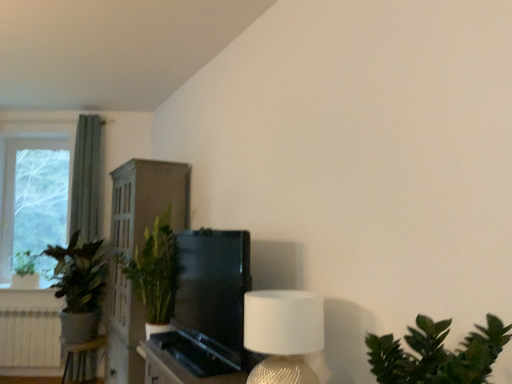
Where is `clear glass window at left`? clear glass window at left is located at coordinates (39, 200).

In order to face white wood cabinet at center, should I rotate leftwards or rightwards?

You should look left and rotate roughly 14.806 degrees.

Locate an element on the screen. green matte plant at left, the 3th houseplant positioned from the front is located at coordinates (25, 271).

What is the approximate height of green leafy plant at lower right, the first houseplant when ordered from front to back?

green leafy plant at lower right, the first houseplant when ordered from front to back, is 9.94 inches in height.

Where is `green leafy plant at lower right, the first houseplant when ordered from front to back`? The image size is (512, 384). green leafy plant at lower right, the first houseplant when ordered from front to back is located at coordinates (437, 354).

This screenshot has width=512, height=384. I want to click on clear glass window at left, so click(x=39, y=200).

From a real-world perspective, between green leafy plant at left, the second houseplant positioned from the front, and green matte plant at left, the third houseplant viewed from the right, who is vertically lower?

In real-world perspective, green leafy plant at left, the second houseplant positioned from the front, is lower.

Which of these two, green leafy plant at left, arranged as the 2th houseplant when viewed from the right, or green matte plant at left, positioned as the first houseplant in back-to-front order, is bigger?

Bigger between the two is green leafy plant at left, arranged as the 2th houseplant when viewed from the right.

Relative to green matte plant at left, the third houseplant viewed from the right, is green leafy plant at left, arranged as the 2th houseplant when viewed from the right, in front or behind?

green leafy plant at left, arranged as the 2th houseplant when viewed from the right, is positioned closer to the viewer than green matte plant at left, the third houseplant viewed from the right.

Is green leafy plant at left, arranged as the 2th houseplant when viewed from the left, spatially inside green matte plant at left, the 3th houseplant positioned from the front, or outside of it?

green leafy plant at left, arranged as the 2th houseplant when viewed from the left, is spatially situated outside green matte plant at left, the 3th houseplant positioned from the front.

Can you confirm if white textured lampshade at upper right is bigger than white wood cabinet at center?

Incorrect, white textured lampshade at upper right is not larger than white wood cabinet at center.

From the image's perspective, between white textured lampshade at upper right and white wood cabinet at center, which one is located above?

white textured lampshade at upper right.

The height and width of the screenshot is (384, 512). Identify the location of dresser below the white textured lampshade at upper right (from the image's perspective). (147, 200).

Does white textured lampshade at upper right touch white wood cabinet at center?

No, white textured lampshade at upper right is not beside white wood cabinet at center.

Could you tell me if green leafy plant at left, which ranks as the 2th houseplant in back-to-front order, is facing white wood cabinet at center?

No, green leafy plant at left, which ranks as the 2th houseplant in back-to-front order, is not facing towards white wood cabinet at center.

Considering the sizes of objects green leafy plant at left, which ranks as the 2th houseplant in back-to-front order, and white wood cabinet at center in the image provided, who is bigger, green leafy plant at left, which ranks as the 2th houseplant in back-to-front order, or white wood cabinet at center?

With larger size is white wood cabinet at center.

Which object is wider, green leafy plant at left, arranged as the 2th houseplant when viewed from the left, or white wood cabinet at center?

With larger width is green leafy plant at left, arranged as the 2th houseplant when viewed from the left.

Locate an element on the screen. the 2nd houseplant below when counting from the white wood cabinet at center (from the image's perspective) is located at coordinates click(x=79, y=287).

Who is smaller, white textured radiator at lower left or green leafy plant at left, arranged as the 2th houseplant when viewed from the right?

With smaller size is white textured radiator at lower left.

From the image's perspective, starting from the white textured radiator at lower left, which houseplant is the 1st one above? Please provide its 2D coordinates.

[(79, 287)]

Does point (25, 359) appear closer or farther from the camera than point (54, 247)?

Point (25, 359) is farther from the camera than point (54, 247).

In the scene shown: Considering the relative positions of white textured radiator at lower left and green leafy plant at left, the second houseplant positioned from the front, in the image provided, is white textured radiator at lower left to the left or to the right of green leafy plant at left, the second houseplant positioned from the front,?

white textured radiator at lower left is positioned on green leafy plant at left, the second houseplant positioned from the front,'s left side.

Could you tell me if white wood cabinet at center is facing clear glass window at left?

No, white wood cabinet at center is not turned towards clear glass window at left.

From the image's perspective, which object appears higher, white wood cabinet at center or clear glass window at left?

clear glass window at left, from the image's perspective.

From a real-world perspective, between white wood cabinet at center and clear glass window at left, who is vertically higher?

clear glass window at left.

In the scene shown: Could clear glass window at left be considered to be inside white wood cabinet at center?

No, clear glass window at left is not a part of white wood cabinet at center.

Is green matte plant at left, the third houseplant viewed from the right, far from green leafy plant at lower right, which is the first houseplant from right to left?

Yes, green matte plant at left, the third houseplant viewed from the right, and green leafy plant at lower right, which is the first houseplant from right to left, are quite far apart.

Between green matte plant at left, the 3th houseplant positioned from the front, and green leafy plant at lower right, which is counted as the 3th houseplant, starting from the back, which one appears on the left side from the viewer's perspective?

From the viewer's perspective, green matte plant at left, the 3th houseplant positioned from the front, appears more on the left side.

How distant is green matte plant at left, the 1th houseplant from the left, from green leafy plant at lower right, which is the first houseplant from right to left?

green matte plant at left, the 1th houseplant from the left, is 5.14 meters from green leafy plant at lower right, which is the first houseplant from right to left.

How much distance is there between clear glass window at left and white wood cabinet at center?

clear glass window at left is 2.03 meters from white wood cabinet at center.

Does clear glass window at left appear on the right side of white wood cabinet at center?

No, clear glass window at left is not to the right of white wood cabinet at center.

Is clear glass window at left oriented away from white wood cabinet at center?

No, clear glass window at left is not facing away from white wood cabinet at center.

Is clear glass window at left thinner than white wood cabinet at center?

Indeed, clear glass window at left has a lesser width compared to white wood cabinet at center.

Identify the location of houseplant that is the 1st one when counting upward from the green leafy plant at left, arranged as the 2th houseplant when viewed from the right (from the image's perspective). This screenshot has height=384, width=512. (25, 271).

You are a GUI agent. You are given a task and a screenshot of the screen. Output one action in this format:
    pyautogui.click(x=<x>, y=<y>)
    Task: Click on the dresser below the white textured lampshade at upper right (from the image's perspective)
    
    Given the screenshot: What is the action you would take?
    pyautogui.click(x=147, y=200)

From the image, which object appears to be nearer to clear glass window at left, white textured lampshade at upper right or white wood cabinet at center?

white wood cabinet at center.

Looking at the image, which one is located closer to green matte plant at left, the third houseplant viewed from the right, white wood cabinet at center or white textured lampshade at upper right?

Based on the image, white wood cabinet at center appears to be nearer to green matte plant at left, the third houseplant viewed from the right.

Estimate the real-world distances between objects in this image. Which object is closer to white wood cabinet at center, white textured radiator at lower left or green leafy plant at left, the second houseplant positioned from the front?

green leafy plant at left, the second houseplant positioned from the front, is closer to white wood cabinet at center.

Which object lies further to the anchor point green leafy plant at lower right, which ranks as the 3th houseplant in left-to-right order, green matte plant at left, the 1th houseplant from the left, or white textured lampshade at upper right?

Based on the image, green matte plant at left, the 1th houseplant from the left, appears to be further to green leafy plant at lower right, which ranks as the 3th houseplant in left-to-right order.

From the image, which object appears to be farther from green leafy plant at lower right, which is counted as the 3th houseplant, starting from the back, white textured radiator at lower left or clear glass window at left?

Among the two, white textured radiator at lower left is located further to green leafy plant at lower right, which is counted as the 3th houseplant, starting from the back.

In the scene shown: Based on their spatial positions, is green leafy plant at lower right, which is the first houseplant from right to left, or clear glass window at left closer to green matte plant at left, the third houseplant viewed from the right?

Based on the image, clear glass window at left appears to be nearer to green matte plant at left, the third houseplant viewed from the right.

Based on their spatial positions, is white textured radiator at lower left or white textured lampshade at upper right further from green leafy plant at lower right, which ranks as the 3th houseplant in left-to-right order?

Based on the image, white textured radiator at lower left appears to be further to green leafy plant at lower right, which ranks as the 3th houseplant in left-to-right order.

Considering their positions, is white textured radiator at lower left positioned closer to green matte plant at left, the 3th houseplant positioned from the front, than green leafy plant at left, the second houseplant positioned from the front?

white textured radiator at lower left lies closer to green matte plant at left, the 3th houseplant positioned from the front, than the other object.

The image size is (512, 384). What are the coordinates of `dresser between green leafy plant at lower right, which ranks as the 3th houseplant in left-to-right order, and white textured radiator at lower left, along the z-axis` in the screenshot? It's located at (147, 200).

Locate an element on the screen. This screenshot has width=512, height=384. houseplant between white textured radiator at lower left and white wood cabinet at center in the horizontal direction is located at coordinates (79, 287).

The height and width of the screenshot is (384, 512). What are the coordinates of `dresser between white textured lampshade at upper right and clear glass window at left in the front-back direction` in the screenshot? It's located at (147, 200).

Image resolution: width=512 pixels, height=384 pixels. What are the coordinates of `houseplant between green leafy plant at lower right, the first houseplant when ordered from front to back, and white textured radiator at lower left, along the z-axis` in the screenshot? It's located at pos(79,287).